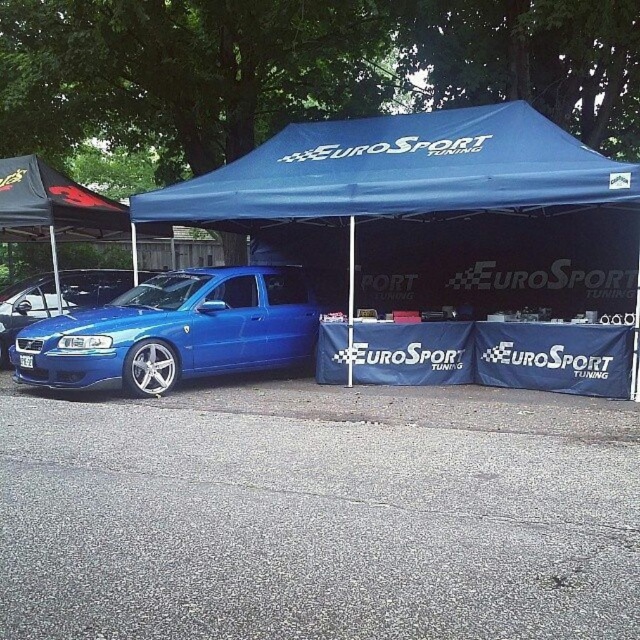
Between point (342, 154) and point (13, 348), which one is positioned in front?

Point (13, 348) is more forward.

Is blue fabric tent at center bigger than matte blue car at center?

Indeed, blue fabric tent at center has a larger size compared to matte blue car at center.

Is point (154, 198) positioned after point (189, 332)?

Yes, point (154, 198) is behind point (189, 332).

This screenshot has width=640, height=640. I want to click on blue fabric tent at center, so click(397, 173).

Looking at this image, which of these two, matte blue car at center or matte blue car at left, stands shorter?

Standing shorter between the two is matte blue car at left.

Can you confirm if matte blue car at center is positioned to the left of matte blue car at left?

Incorrect, matte blue car at center is not on the left side of matte blue car at left.

Which is behind, point (38, 340) or point (10, 291)?

Positioned behind is point (10, 291).

Image resolution: width=640 pixels, height=640 pixels. In order to click on matte blue car at center in this screenshot , I will do `click(173, 332)`.

Is blue fabric tent at center taller than matte blue car at left?

Correct, blue fabric tent at center is much taller as matte blue car at left.

Which is behind, point (371, 186) or point (20, 301)?

Point (20, 301)

Which is in front, point (298, 170) or point (108, 275)?

Point (298, 170)

The height and width of the screenshot is (640, 640). What are the coordinates of `blue fabric tent at center` in the screenshot? It's located at (397, 173).